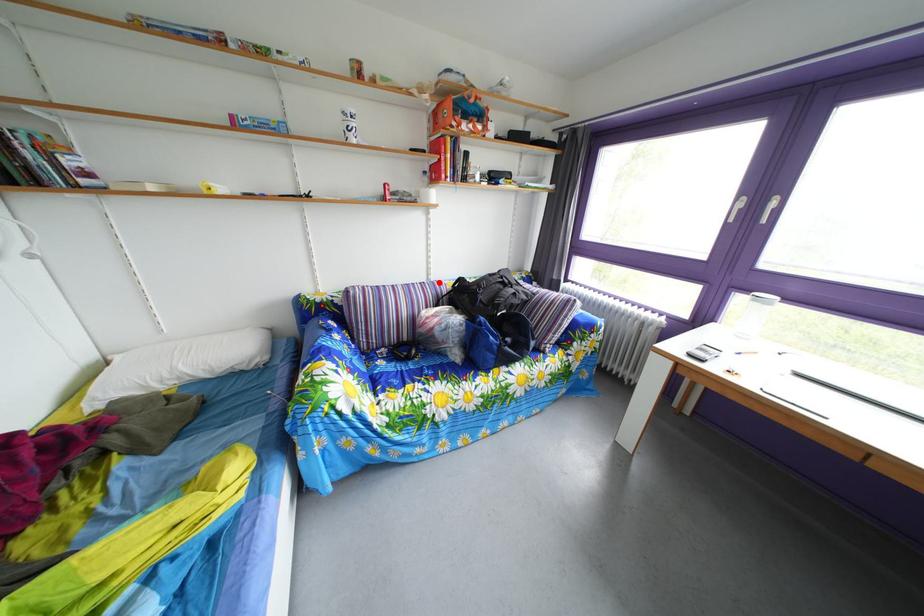
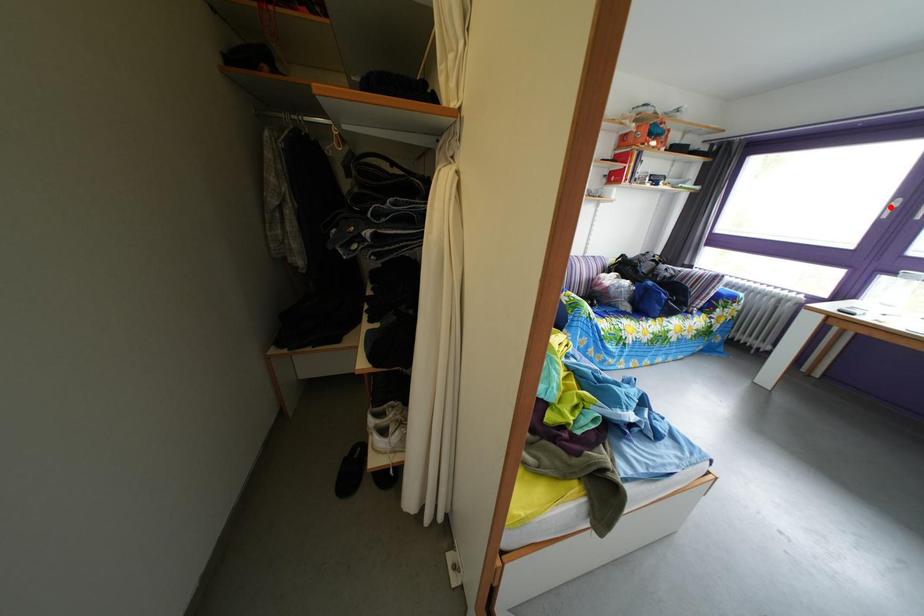
Looking at this image, I am providing you with two images of the same scene from different viewpoints. A red point is marked on the first image and another point is marked on the second image. Are the points marked in image1 and image2 representing the same 3D position?

No